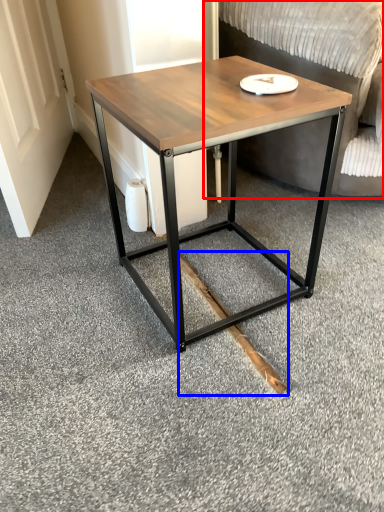
Question: Which object is closer to the camera taking this photo, swivel chair (highlighted by a red box) or wood (highlighted by a blue box)?

Choices:
 (A) swivel chair
 (B) wood

Answer: (A)